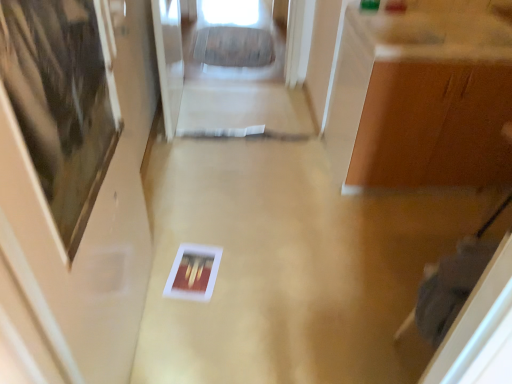
Question: Is matte wood door at left thinner than matte brown cabinet at upper right?

Choices:
 (A) yes
 (B) no

Answer: (A)

Question: From a real-world perspective, is matte wood door at left positioned under matte brown cabinet at upper right based on gravity?

Choices:
 (A) no
 (B) yes

Answer: (A)

Question: Is matte wood door at left taller than matte brown cabinet at upper right?

Choices:
 (A) yes
 (B) no

Answer: (A)

Question: Is matte wood door at left to the right of matte brown cabinet at upper right from the viewer's perspective?

Choices:
 (A) no
 (B) yes

Answer: (A)

Question: From a real-world perspective, is matte wood door at left located higher than matte brown cabinet at upper right?

Choices:
 (A) no
 (B) yes

Answer: (B)

Question: Is matte brown cabinet at upper right to the left or to the right of matte wood door at left in the image?

Choices:
 (A) left
 (B) right

Answer: (B)

Question: Is matte brown cabinet at upper right inside or outside of matte wood door at left?

Choices:
 (A) outside
 (B) inside

Answer: (A)

Question: From a real-world perspective, is matte brown cabinet at upper right above or below matte wood door at left?

Choices:
 (A) above
 (B) below

Answer: (B)

Question: Is point (485, 96) positioned closer to the camera than point (4, 226)?

Choices:
 (A) farther
 (B) closer

Answer: (A)

Question: In the image, is matte wood door at left on the left side or the right side of matte brown cabinet at upper right?

Choices:
 (A) left
 (B) right

Answer: (A)

Question: From the image's perspective, relative to matte brown cabinet at upper right, is matte wood door at left above or below?

Choices:
 (A) below
 (B) above

Answer: (A)

Question: Does point (46, 180) appear closer or farther from the camera than point (510, 29)?

Choices:
 (A) farther
 (B) closer

Answer: (B)

Question: From their relative heights in the image, would you say matte wood door at left is taller or shorter than matte brown cabinet at upper right?

Choices:
 (A) short
 (B) tall

Answer: (B)

Question: From the image's perspective, relative to matte brown cabinet at upper right, is transparent glass door at upper center above or below?

Choices:
 (A) below
 (B) above

Answer: (B)

Question: In terms of height, does transparent glass door at upper center look taller or shorter compared to matte brown cabinet at upper right?

Choices:
 (A) tall
 (B) short

Answer: (A)